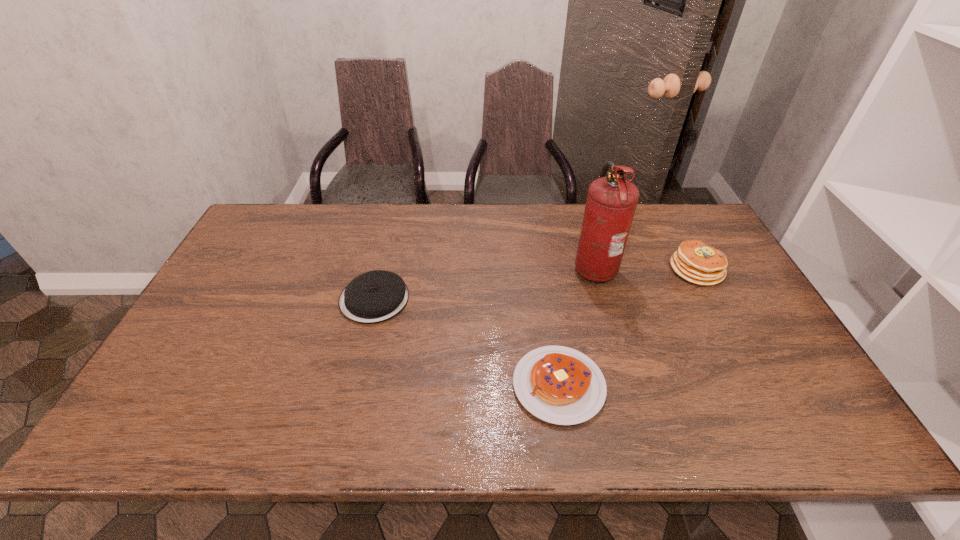
The width and height of the screenshot is (960, 540). I want to click on vacant region at the far right corner of the desktop, so click(698, 217).

Where is `free space that is in between the fire extinguisher and the nearest pancake`? free space that is in between the fire extinguisher and the nearest pancake is located at coordinates (576, 326).

The height and width of the screenshot is (540, 960). I want to click on unoccupied area between the leftmost pancake and the second tallest object, so click(536, 284).

This screenshot has width=960, height=540. In order to click on vacant area that lies between the tallest object and the rightmost pancake in this screenshot , I will do `click(645, 268)`.

Find the location of a particular element. This screenshot has height=540, width=960. vacant region between the leftmost object and the second pancake from right to left is located at coordinates (467, 342).

Locate an element on the screen. empty space between the rightmost pancake and the fire extinguisher is located at coordinates pos(645,268).

Locate an element on the screen. free area in between the second pancake from left to right and the tallest object is located at coordinates (576, 326).

Locate an element on the screen. This screenshot has width=960, height=540. vacant space that's between the shortest object and the second tallest pancake is located at coordinates (467, 342).

You are a GUI agent. You are given a task and a screenshot of the screen. Output one action in this format:
    pyautogui.click(x=<x>, y=<y>)
    Task: Click on the free spot between the tallest object and the rightmost pancake
    The width and height of the screenshot is (960, 540).
    Given the screenshot: What is the action you would take?
    pyautogui.click(x=645, y=268)

At what (x,y) coordinates should I click in order to perform the action: click on empty space that is in between the leftmost object and the fire extinguisher. Please return your answer as a coordinate pair (x, y). The height and width of the screenshot is (540, 960). Looking at the image, I should click on (484, 282).